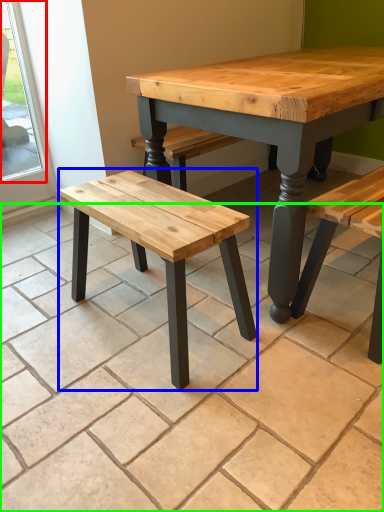
Question: Considering the real-world distances, which object is farthest from window (highlighted by a red box)? stool (highlighted by a blue box) or tile (highlighted by a green box)?

Choices:
 (A) stool
 (B) tile

Answer: (A)